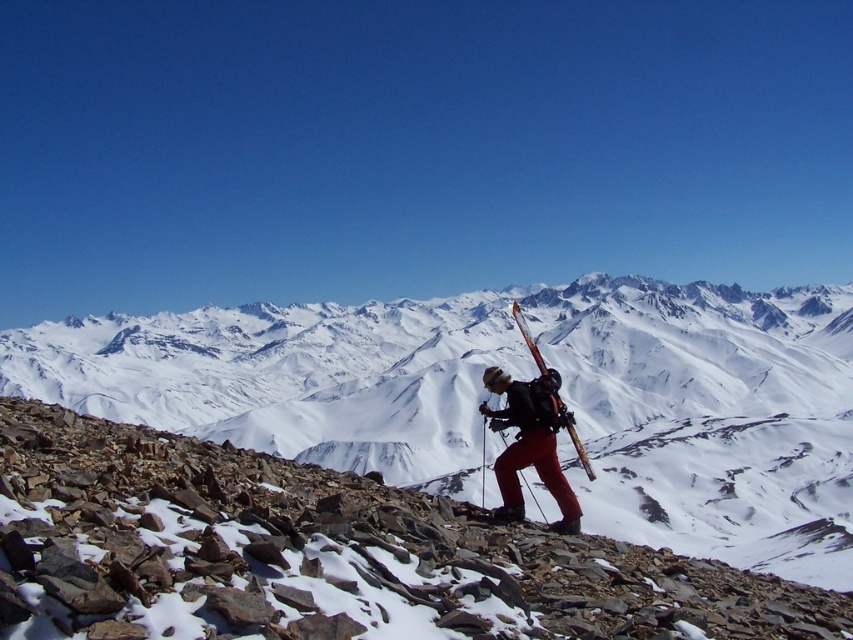
Question: Is snowy rocky mountain at center smaller than matte black backpack at center?

Choices:
 (A) no
 (B) yes

Answer: (A)

Question: Which object is closer to the camera taking this photo?

Choices:
 (A) snowy rocky mountain at center
 (B) matte black backpack at center

Answer: (B)

Question: Does matte black backpack at center come in front of matte black ski at center?

Choices:
 (A) no
 (B) yes

Answer: (B)

Question: Which object is closer to the camera taking this photo?

Choices:
 (A) matte black backpack at center
 (B) matte black ski at center

Answer: (A)

Question: Can you confirm if snowy rocky mountain at center is positioned to the left of matte black backpack at center?

Choices:
 (A) yes
 (B) no

Answer: (A)

Question: Which of these objects is positioned closest to the snowy rocky mountain at center?

Choices:
 (A) matte black backpack at center
 (B) matte black ski at center

Answer: (B)